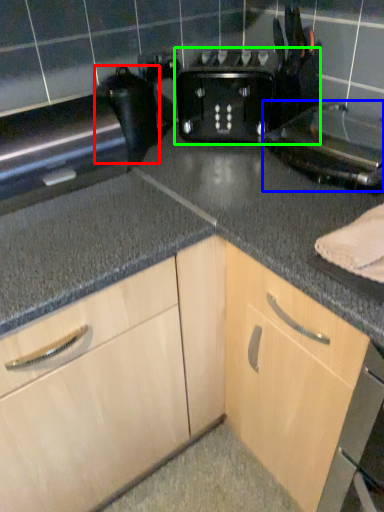
Question: Based on their relative distances, which object is nearer to appliance (highlighted by a red box)? Choose from appliance (highlighted by a blue box) and toaster (highlighted by a green box).

Choices:
 (A) appliance
 (B) toaster

Answer: (B)